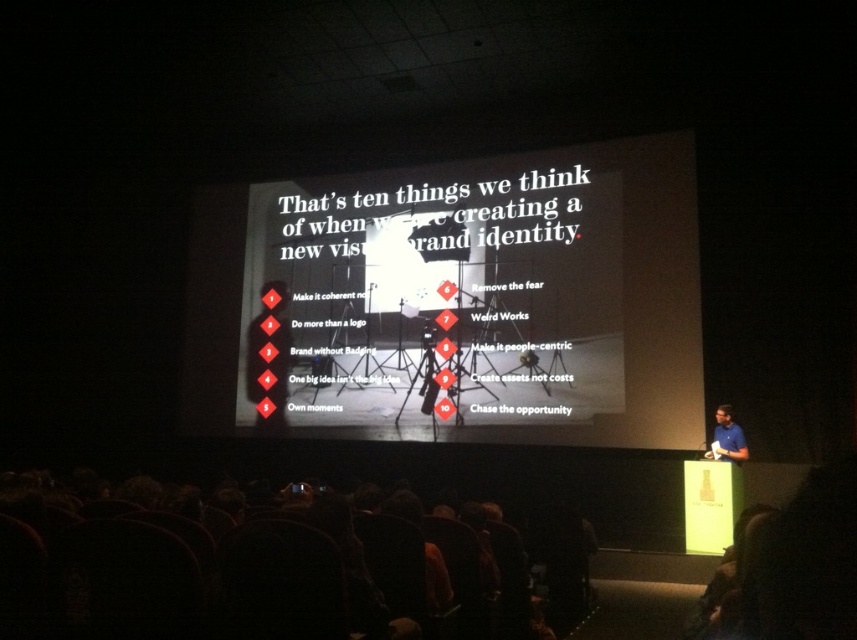
What do you see at coordinates (444, 294) in the screenshot?
I see `white paper at center` at bounding box center [444, 294].

Between white paper at center and blue shirt at right, which one has more height?

white paper at center

I want to click on white paper at center, so click(x=444, y=294).